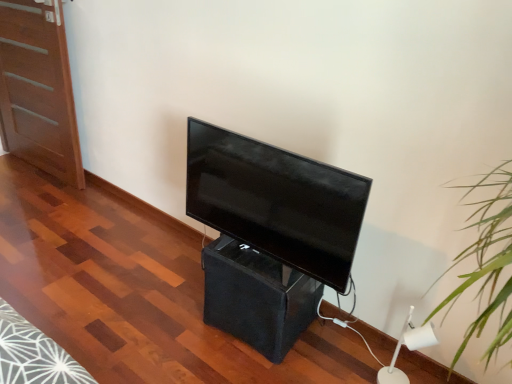
Question: Considering the positions of white plastic lamp at lower right and black fabric speaker at center in the image, is white plastic lamp at lower right taller or shorter than black fabric speaker at center?

Choices:
 (A) short
 (B) tall

Answer: (A)

Question: Is white plastic lamp at lower right wider or thinner than black fabric speaker at center?

Choices:
 (A) wide
 (B) thin

Answer: (B)

Question: Which object is positioned closest to the matte wood door at left?

Choices:
 (A) matte black tv at center
 (B) black fabric speaker at center
 (C) white plastic lamp at lower right

Answer: (A)

Question: Which object is positioned closest to the matte wood door at left?

Choices:
 (A) matte black tv at center
 (B) white plastic lamp at lower right
 (C) black fabric speaker at center

Answer: (A)